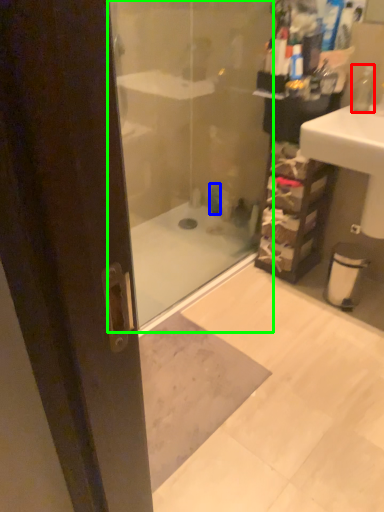
Question: Estimate the real-world distances between objects in this image. Which object is farther from soap dispenser (highlighted by a red box), toiletry (highlighted by a blue box) or shower door (highlighted by a green box)?

Choices:
 (A) toiletry
 (B) shower door

Answer: (B)